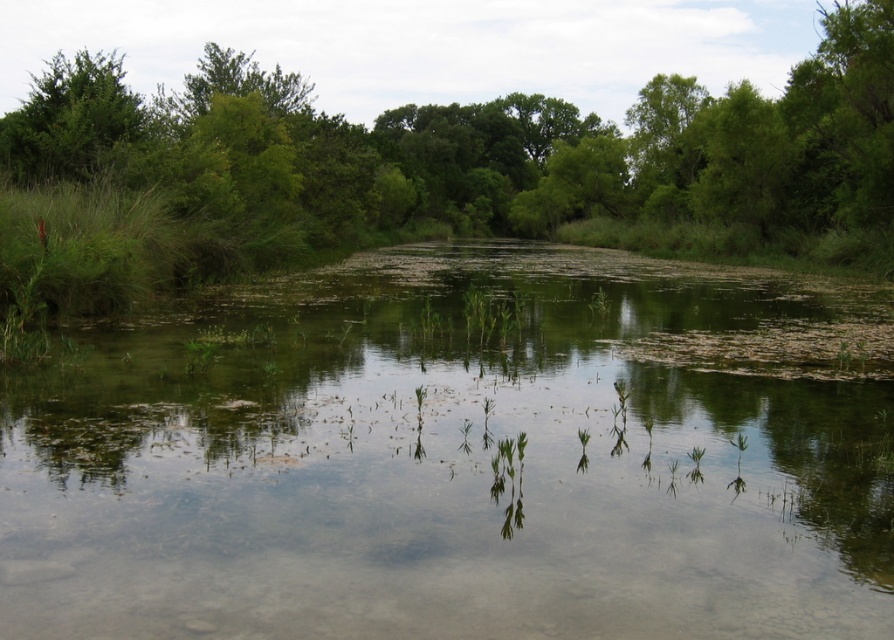
You are standing at the edge of the water and want to take a photo of the green leafy tree at upper left and the clear water at center. Which object is closer to the camera?

The clear water at center is located below the green leafy tree at upper left, meaning the tree is higher up in the image and thus closer to the camera than the water.

You are standing at the edge of the water and want to take a photo of the green leafy tree at upper left and the clear water at center. Which object is positioned to the right of the other?

The clear water at center is to the right of the green leafy tree at upper left.